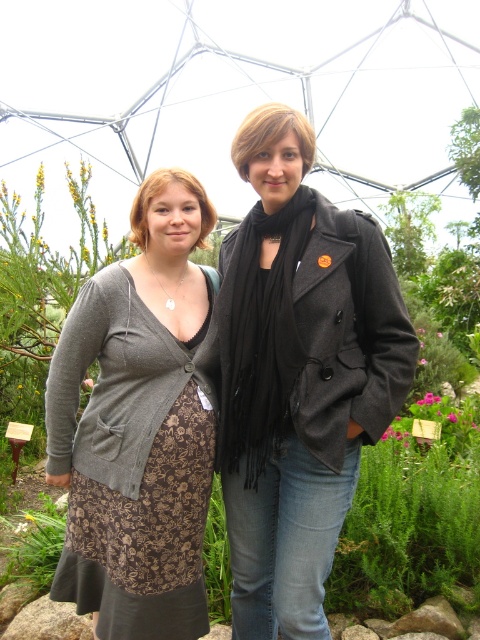
Question: Does matte black coat at center appear under green leafy plant at lower left?

Choices:
 (A) no
 (B) yes

Answer: (A)

Question: Which of these objects is positioned closest to the matte gray cardigan at center?

Choices:
 (A) matte black scarf at center
 (B) matte black coat at center
 (C) matte brown dress at center

Answer: (B)

Question: Which object is farther from the camera taking this photo?

Choices:
 (A) matte gray cardigan at center
 (B) matte brown dress at center
 (C) matte black coat at center
 (D) green leafy plant at lower left

Answer: (D)

Question: Is matte gray cardigan at center to the right of matte brown dress at center from the viewer's perspective?

Choices:
 (A) no
 (B) yes

Answer: (A)

Question: In this image, where is matte black coat at center located relative to matte gray cardigan at center?

Choices:
 (A) below
 (B) above

Answer: (B)

Question: Among these objects, which one is farthest from the camera?

Choices:
 (A) green leafy plant at lower left
 (B) matte black scarf at center

Answer: (A)